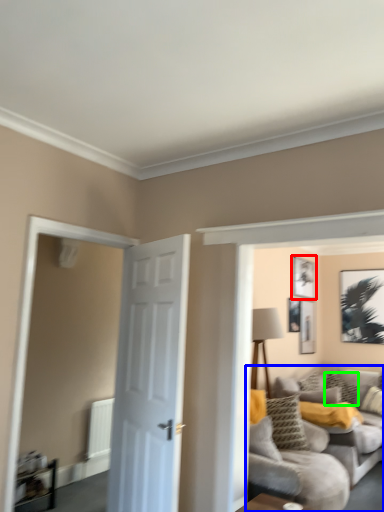
Question: Which is nearer to the picture frame (highlighted by a red box)? studio couch (highlighted by a blue box) or pillow (highlighted by a green box).

Choices:
 (A) studio couch
 (B) pillow

Answer: (B)